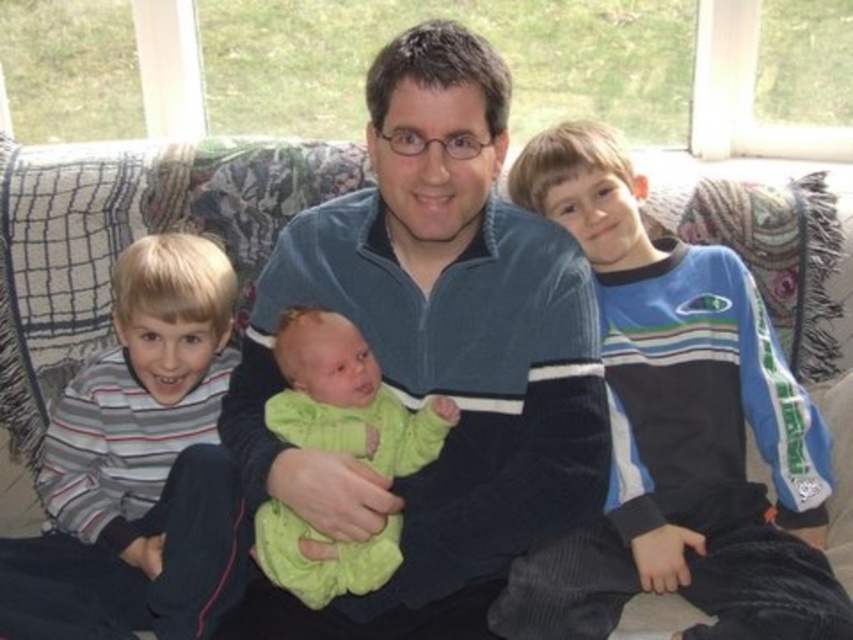
You are standing in front of the couch where the family is sitting. There are two points marked on the couch. One is at coordinates point (537, 372) and the other is at point (770, 522). Which point is closer to you?

The point at coordinates point (537, 372) is closer to the viewer than point (770, 522).

You are an interior designer planning to place a new lamp on the couch. The lamp requires a space of at least 10 cm in width. Given the velvet blue sweater at center is located at point 0.556, 0.509, can you confirm if there is enough space next to it for the lamp?

The velvet blue sweater at center is located at point (433, 355). Since the exact dimensions of the couch and the space around the sweater are not provided, it is unclear if there is sufficient space for the lamp. Further measurements are needed.